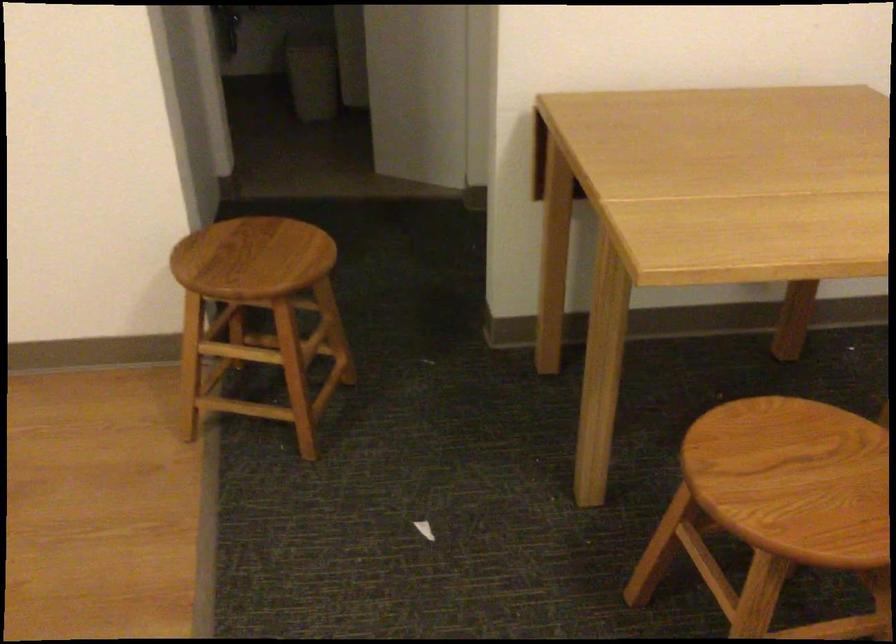
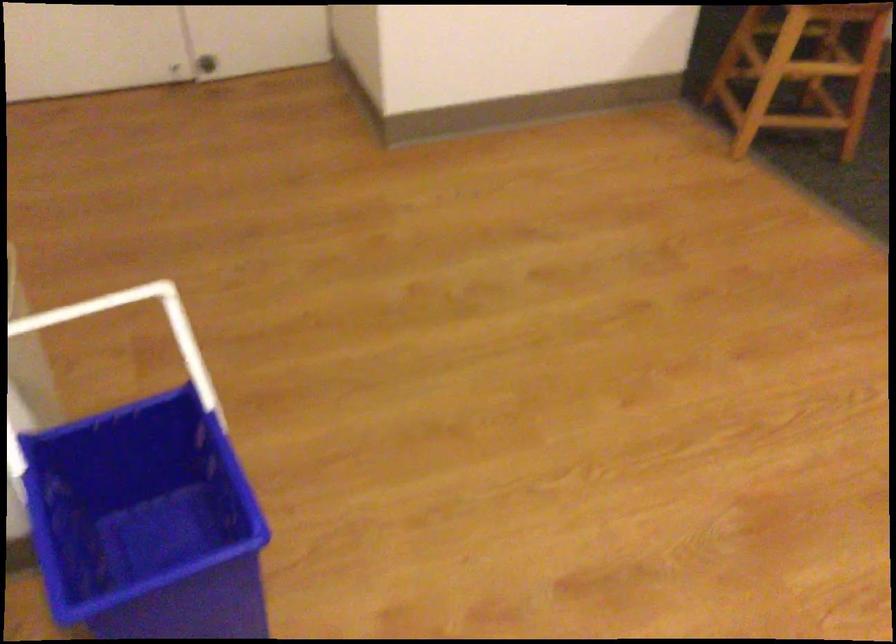
The point at (355,360) is marked in the first image. Where is the corresponding point in the second image?

(794, 90)